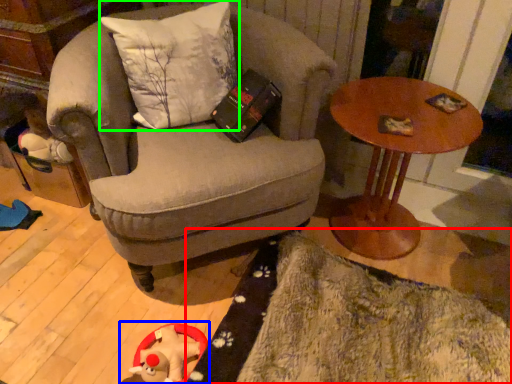
Question: Considering the real-world distances, which object is closest to mat (highlighted by a red box)? toy (highlighted by a blue box) or pillow (highlighted by a green box).

Choices:
 (A) toy
 (B) pillow

Answer: (A)